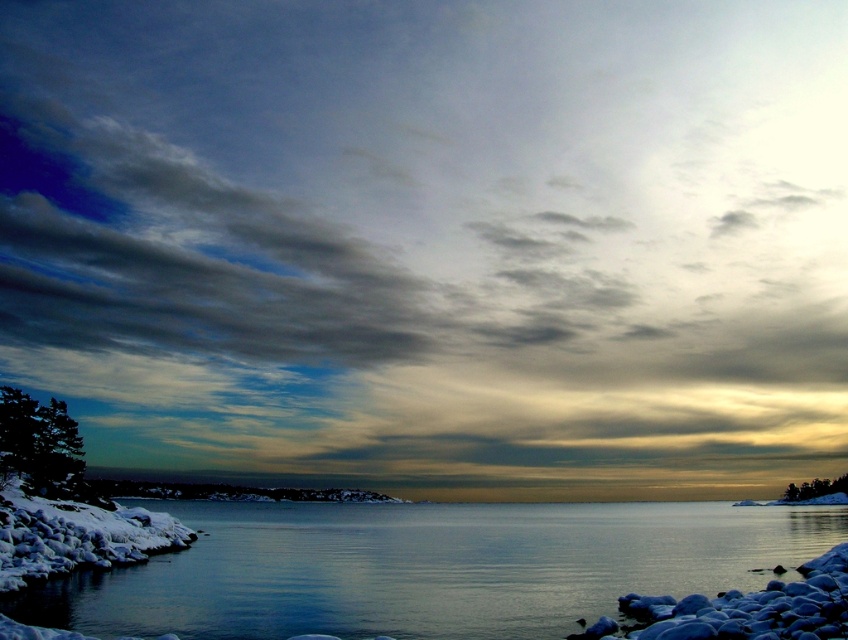
Question: Among these points, which one is farthest from the camera?

Choices:
 (A) (4, 449)
 (B) (353, 538)

Answer: (B)

Question: Based on their relative distances, which object is nearer to the green matte tree at lower left?

Choices:
 (A) clear glass water at center
 (B) green matte tree at right

Answer: (A)

Question: Is clear glass water at center in front of green matte tree at right?

Choices:
 (A) no
 (B) yes

Answer: (B)

Question: Considering the real-world distances, which object is closest to the clear glass water at center?

Choices:
 (A) green matte tree at lower left
 (B) green matte tree at right

Answer: (A)

Question: Is green matte tree at lower left above green matte tree at right?

Choices:
 (A) yes
 (B) no

Answer: (A)

Question: Does clear glass water at center have a lesser width compared to green matte tree at lower left?

Choices:
 (A) no
 (B) yes

Answer: (A)